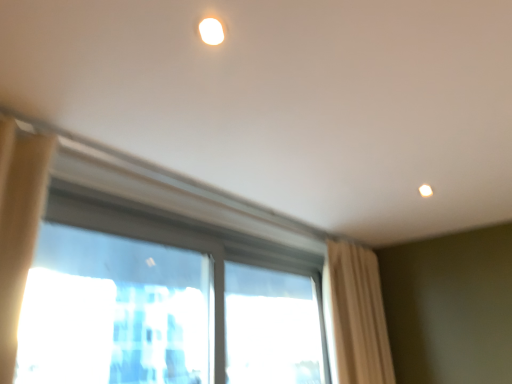
Describe the element at coordinates (163, 302) in the screenshot. I see `transparent glass window at center, the second window positioned from the right` at that location.

What do you see at coordinates (113, 312) in the screenshot? I see `transparent glass window at center` at bounding box center [113, 312].

Image resolution: width=512 pixels, height=384 pixels. Find the location of `transparent glass window at center, the second window positioned from the right`. transparent glass window at center, the second window positioned from the right is located at coordinates (163, 302).

Which is in front, point (188, 284) or point (266, 316)?

The point (188, 284) is more forward.

Is transparent glass window at center looking in the opposite direction of transparent glass window at center, the second window positioned from the right?

Yes, transparent glass window at center's orientation is away from transparent glass window at center, the second window positioned from the right.

From the image's perspective, which is below, transparent glass window at center or transparent glass window at center, the second window positioned from the right?

transparent glass window at center, the second window positioned from the right.

Can you confirm if transparent glass window at center is bigger than transparent glass window at center, the second window positioned from the right?

Indeed, transparent glass window at center has a larger size compared to transparent glass window at center, the second window positioned from the right.

In the scene shown: Is transparent glass window at center, the second window positioned from the right, oriented away from transparent glass window at center, marked as the 2th window in a left-to-right arrangement?

That's right, transparent glass window at center, the second window positioned from the right, is facing away from transparent glass window at center, marked as the 2th window in a left-to-right arrangement.

How many degrees apart are the facing directions of transparent glass window at center, the second window positioned from the right, and transparent glass window at center, marked as the 2th window in a left-to-right arrangement?

There is a 0.605-degree angle between the facing directions of transparent glass window at center, the second window positioned from the right, and transparent glass window at center, marked as the 2th window in a left-to-right arrangement.

Is transparent glass window at center, the second window positioned from the right, to the left of transparent glass window at center, marked as the 2th window in a left-to-right arrangement, from the viewer's perspective?

Correct, you'll find transparent glass window at center, the second window positioned from the right, to the left of transparent glass window at center, marked as the 2th window in a left-to-right arrangement.

Looking at this image, considering their positions, is transparent glass window at center, the second window positioned from the right, located in front of or behind transparent glass window at center, marked as the 2th window in a left-to-right arrangement?

In the image, transparent glass window at center, the second window positioned from the right, appears in front of transparent glass window at center, marked as the 2th window in a left-to-right arrangement.

Based on their sizes in the image, would you say transparent glass window at center, acting as the 1th window starting from the right, is bigger or smaller than beige fabric curtain at right?

Considering their sizes, transparent glass window at center, acting as the 1th window starting from the right, takes up less space than beige fabric curtain at right.

Is the depth of transparent glass window at center, marked as the 2th window in a left-to-right arrangement, greater than that of beige fabric curtain at right?

No, transparent glass window at center, marked as the 2th window in a left-to-right arrangement, is in front of beige fabric curtain at right.

Is transparent glass window at center, marked as the 2th window in a left-to-right arrangement, positioned far away from beige fabric curtain at right?

Actually, transparent glass window at center, marked as the 2th window in a left-to-right arrangement, and beige fabric curtain at right are a little close together.

Is transparent glass window at center, marked as the 2th window in a left-to-right arrangement, at the left side of beige fabric curtain at right?

Yes.

Is beige fabric curtain at right aimed at transparent glass window at center, acting as the 1th window starting from the right?

No, beige fabric curtain at right is not facing towards transparent glass window at center, acting as the 1th window starting from the right.

Considering the sizes of objects beige fabric curtain at right and transparent glass window at center, marked as the 2th window in a left-to-right arrangement, in the image provided, who is taller, beige fabric curtain at right or transparent glass window at center, marked as the 2th window in a left-to-right arrangement,?

With more height is beige fabric curtain at right.

Is beige fabric curtain at right wider or thinner than transparent glass window at center, acting as the 1th window starting from the right?

Clearly, beige fabric curtain at right has more width compared to transparent glass window at center, acting as the 1th window starting from the right.

How distant is transparent glass window at center, acting as the 1th window starting from the right, from transparent glass window at center?

A distance of 1.59 meters exists between transparent glass window at center, acting as the 1th window starting from the right, and transparent glass window at center.

Can you confirm if transparent glass window at center, marked as the 2th window in a left-to-right arrangement, is bigger than transparent glass window at center?

No, transparent glass window at center, marked as the 2th window in a left-to-right arrangement, is not bigger than transparent glass window at center.

Considering the relative sizes of transparent glass window at center, marked as the 2th window in a left-to-right arrangement, and transparent glass window at center in the image provided, is transparent glass window at center, marked as the 2th window in a left-to-right arrangement, taller than transparent glass window at center?

Indeed, transparent glass window at center, marked as the 2th window in a left-to-right arrangement, has a greater height compared to transparent glass window at center.

From the picture: Do you think transparent glass window at center, acting as the 1th window starting from the right, is within transparent glass window at center, or outside of it?

transparent glass window at center, acting as the 1th window starting from the right, exists outside the volume of transparent glass window at center.

Looking at this image, from the image's perspective, is transparent glass window at center over transparent glass window at center, acting as the 1th window starting from the right?

Yes.

Is transparent glass window at center in front of or behind transparent glass window at center, acting as the 1th window starting from the right, in the image?

In the image, transparent glass window at center appears in front of transparent glass window at center, acting as the 1th window starting from the right.

Between transparent glass window at center and transparent glass window at center, marked as the 2th window in a left-to-right arrangement, which one has smaller width?

transparent glass window at center, marked as the 2th window in a left-to-right arrangement.

Is transparent glass window at center looking in the opposite direction of transparent glass window at center, acting as the 1th window starting from the right?

No, transparent glass window at center, acting as the 1th window starting from the right, is not at the back of transparent glass window at center.

Is beige fabric curtain at right looking in the opposite direction of transparent glass window at center, the second window positioned from the right?

Correct, beige fabric curtain at right is looking away from transparent glass window at center, the second window positioned from the right.

Is beige fabric curtain at right far away from transparent glass window at center, acting as the 1th window starting from the left?

No, beige fabric curtain at right is not far away from transparent glass window at center, acting as the 1th window starting from the left.

Considering the relative positions of beige fabric curtain at right and transparent glass window at center, the second window positioned from the right, in the image provided, is beige fabric curtain at right to the right of transparent glass window at center, the second window positioned from the right, from the viewer's perspective?

Correct, you'll find beige fabric curtain at right to the right of transparent glass window at center, the second window positioned from the right.

Can you confirm if beige fabric curtain at right is bigger than transparent glass window at center, the second window positioned from the right?

Yes.

The width and height of the screenshot is (512, 384). Identify the location of window that is the 1st one when counting backward from the transparent glass window at center. (163, 302).

This screenshot has height=384, width=512. I want to click on window lying on the right of transparent glass window at center, the second window positioned from the right, so click(x=273, y=328).

Estimate the real-world distances between objects in this image. Which object is closer to transparent glass window at center, transparent glass window at center, acting as the 1th window starting from the left, or transparent glass window at center, marked as the 2th window in a left-to-right arrangement?

Based on the image, transparent glass window at center, marked as the 2th window in a left-to-right arrangement, appears to be nearer to transparent glass window at center.

Considering their positions, is transparent glass window at center positioned closer to beige fabric curtain at right than transparent glass window at center, the second window positioned from the right?

transparent glass window at center, the second window positioned from the right, is positioned closer to the anchor beige fabric curtain at right.

When comparing their distances from transparent glass window at center, acting as the 1th window starting from the left, does beige fabric curtain at right or transparent glass window at center, marked as the 2th window in a left-to-right arrangement, seem closer?

Among the two, transparent glass window at center, marked as the 2th window in a left-to-right arrangement, is located nearer to transparent glass window at center, acting as the 1th window starting from the left.

Which object lies nearer to the anchor point transparent glass window at center, the second window positioned from the right, transparent glass window at center or beige fabric curtain at right?

beige fabric curtain at right is positioned closer to the anchor transparent glass window at center, the second window positioned from the right.

Looking at the image, which one is located closer to beige fabric curtain at right, transparent glass window at center, the second window positioned from the right, or transparent glass window at center?

transparent glass window at center, the second window positioned from the right, is positioned closer to the anchor beige fabric curtain at right.

Based on their spatial positions, is beige fabric curtain at right or transparent glass window at center closer to transparent glass window at center, marked as the 2th window in a left-to-right arrangement?

beige fabric curtain at right.

When comparing their distances from beige fabric curtain at right, does transparent glass window at center, marked as the 2th window in a left-to-right arrangement, or transparent glass window at center, the second window positioned from the right, seem closer?

transparent glass window at center, the second window positioned from the right, lies closer to beige fabric curtain at right than the other object.

From the image, which object appears to be farther from transparent glass window at center, acting as the 1th window starting from the right, transparent glass window at center or transparent glass window at center, the second window positioned from the right?

transparent glass window at center is positioned further to the anchor transparent glass window at center, acting as the 1th window starting from the right.

Locate an element on the screen. The width and height of the screenshot is (512, 384). window between transparent glass window at center, acting as the 1th window starting from the left, and beige fabric curtain at right, along the z-axis is located at coordinates (273, 328).

This screenshot has width=512, height=384. Identify the location of window located between transparent glass window at center and transparent glass window at center, marked as the 2th window in a left-to-right arrangement, in the depth direction. (163, 302).